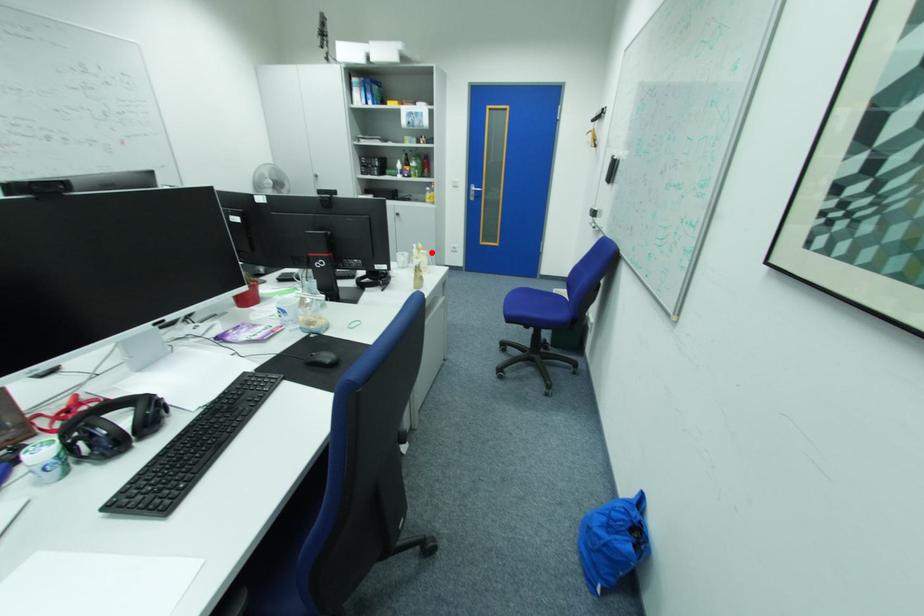
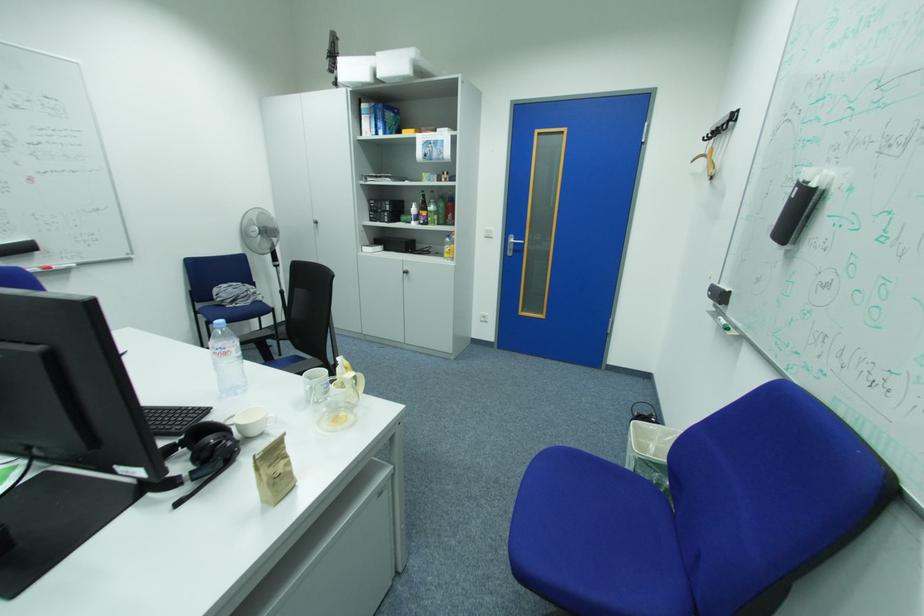
Where in the second image is the point corresponding to the highlighted location from the first image?

(359, 374)